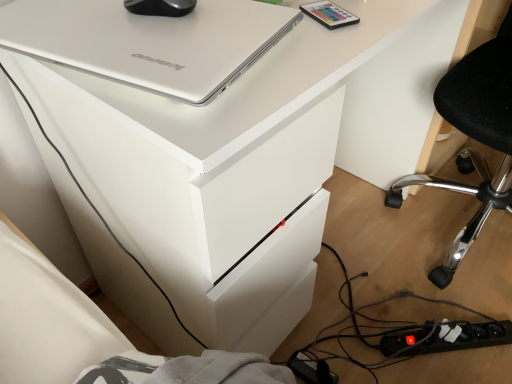
You are a GUI agent. You are given a task and a screenshot of the screen. Output one action in this format:
    pyautogui.click(x=<x>, y=<y>)
    Task: Click on the blank space situated above silver metallic laptop at upper left (from a real-world perspective)
    Image resolution: width=512 pixels, height=384 pixels.
    Given the screenshot: What is the action you would take?
    pyautogui.click(x=133, y=21)